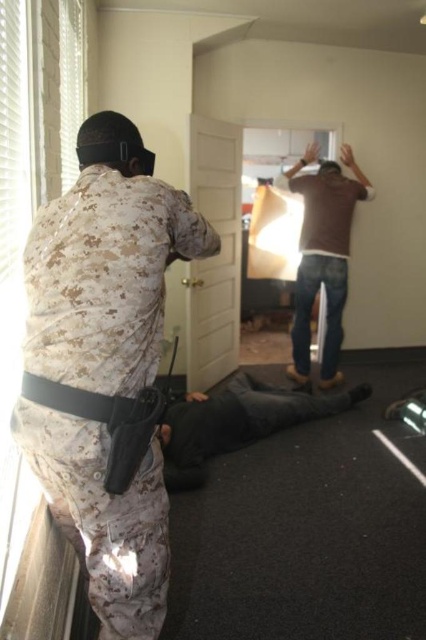
Question: In this image, where is transparent glass window at upper left located relative to black matte holster at lower left?

Choices:
 (A) above
 (B) below

Answer: (A)

Question: Which of the following is the closest to the observer?

Choices:
 (A) (108, 490)
 (B) (31, 634)
 (C) (117, 253)

Answer: (B)

Question: Estimate the real-world distances between objects in this image. Which object is farther from the black matte holster at lower left?

Choices:
 (A) camouflagetextured fabric at left
 (B) camouflage fabric uniform at center
 (C) transparent glass window at upper left
 (D) brown matte shirt at upper center

Answer: (D)

Question: Which object is positioned farthest from the brown matte shirt at upper center?

Choices:
 (A) camouflage fabric uniform at center
 (B) camouflagetextured fabric at left

Answer: (B)

Question: In this image, where is camouflagetextured fabric at left located relative to transparent glass window at upper left?

Choices:
 (A) above
 (B) below

Answer: (B)

Question: Can you confirm if brown matte shirt at upper center is positioned above camouflage fabric uniform at center?

Choices:
 (A) no
 (B) yes

Answer: (B)